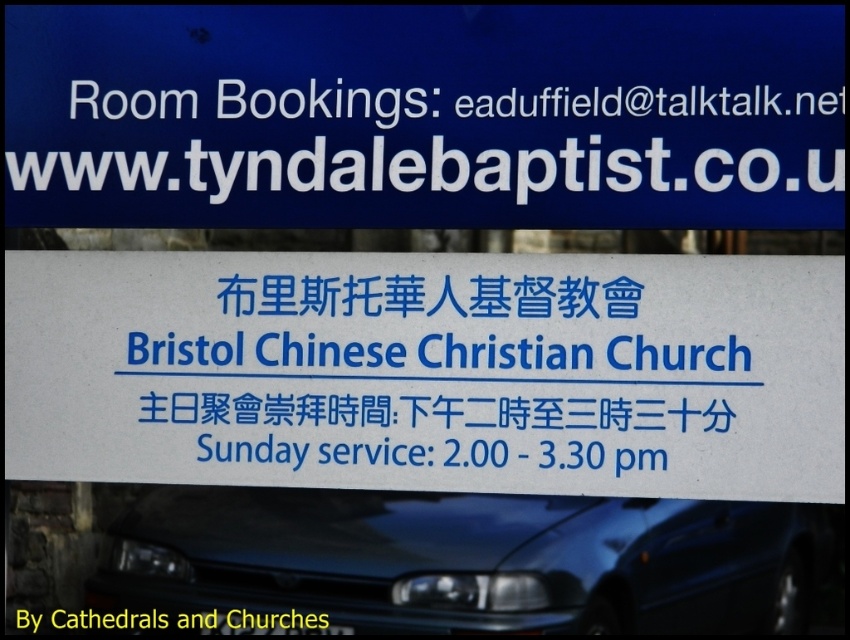
You are planning to hang a new sign on the church bulletin board. The new sign is 1 meter wide. There is already a blue plastic sign at upper center and a white paper sign at center. Based on the existing signs, will the new sign fit horizontally between them without overlapping?

The blue plastic sign at upper center might be wider than the white paper sign at center, so it is uncertain if the new sign will fit. Check the exact widths before deciding.

From the picture: What are the coordinates of the white paper sign at center?

The coordinates of the white paper sign at center are at point (431,365).